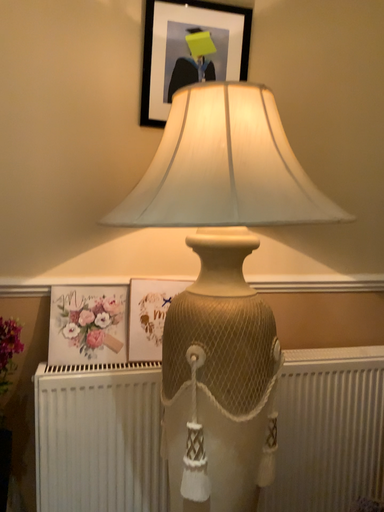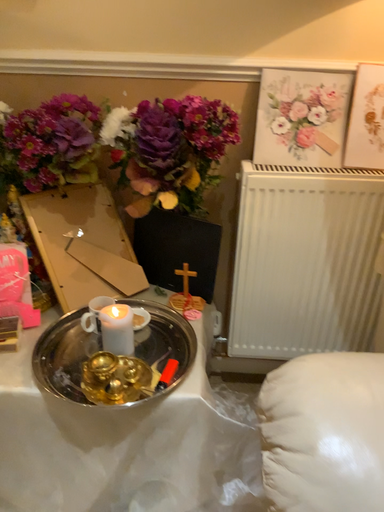
Question: How did the camera likely rotate when shooting the video?

Choices:
 (A) rotated right
 (B) rotated left

Answer: (B)